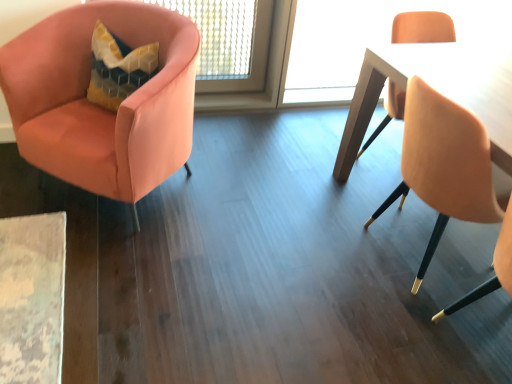
Question: Is wooden table at right spatially inside matte gold chair at right, which appears as the second chair when viewed from the left, or outside of it?

Choices:
 (A) inside
 (B) outside

Answer: (B)

Question: Is wooden table at right bigger or smaller than matte gold chair at right, the first chair when ordered from right to left?

Choices:
 (A) small
 (B) big

Answer: (B)

Question: Which is farther from the matte gold chair at right, which appears as the second chair when viewed from the left?

Choices:
 (A) wooden table at right
 (B) satin pink armchair at left, which is the first chair in left-to-right order

Answer: (B)

Question: Which is farther from the matte gold chair at right, which appears as the second chair when viewed from the left?

Choices:
 (A) wooden table at right
 (B) satin pink armchair at left, which is the first chair in left-to-right order

Answer: (B)